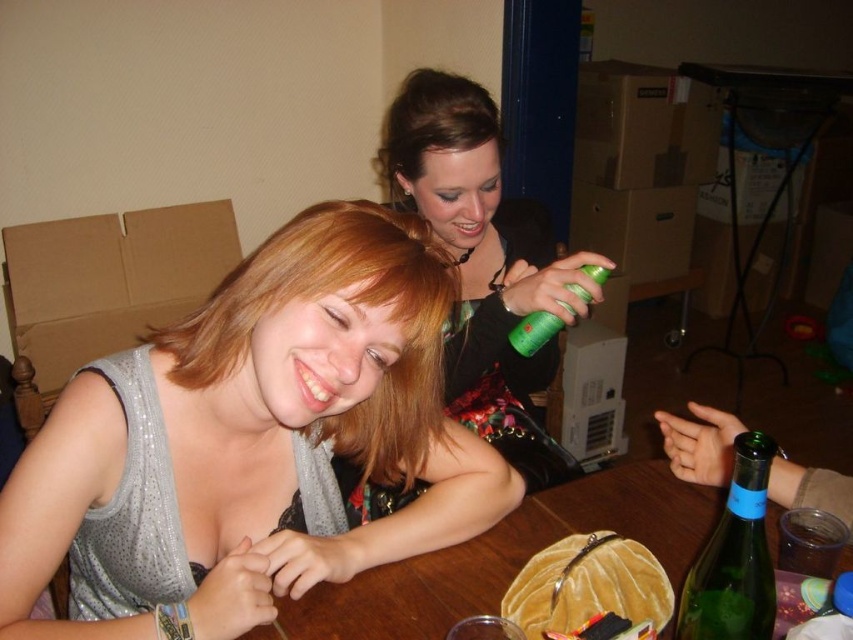
Question: Can you confirm if shiny silver tank top at center is positioned to the left of velvet brown purse at center?

Choices:
 (A) no
 (B) yes

Answer: (B)

Question: Which object is the closest to the shiny silver tank top at center?

Choices:
 (A) green matte spray can at upper center
 (B) green glass bottle at lower right

Answer: (A)

Question: Is velvet brown purse at center closer to the viewer compared to green matte spray can at upper center?

Choices:
 (A) yes
 (B) no

Answer: (A)

Question: Which object is farther from the camera taking this photo?

Choices:
 (A) green glass bottle at lower right
 (B) green matte spray can at upper center
 (C) shiny silver tank top at center

Answer: (B)

Question: Is shiny silver tank top at center bigger than velvet brown purse at center?

Choices:
 (A) no
 (B) yes

Answer: (B)

Question: Which is farther from the shiny silver tank top at center?

Choices:
 (A) green glass bottle at lower right
 (B) green matte spray can at upper center

Answer: (A)